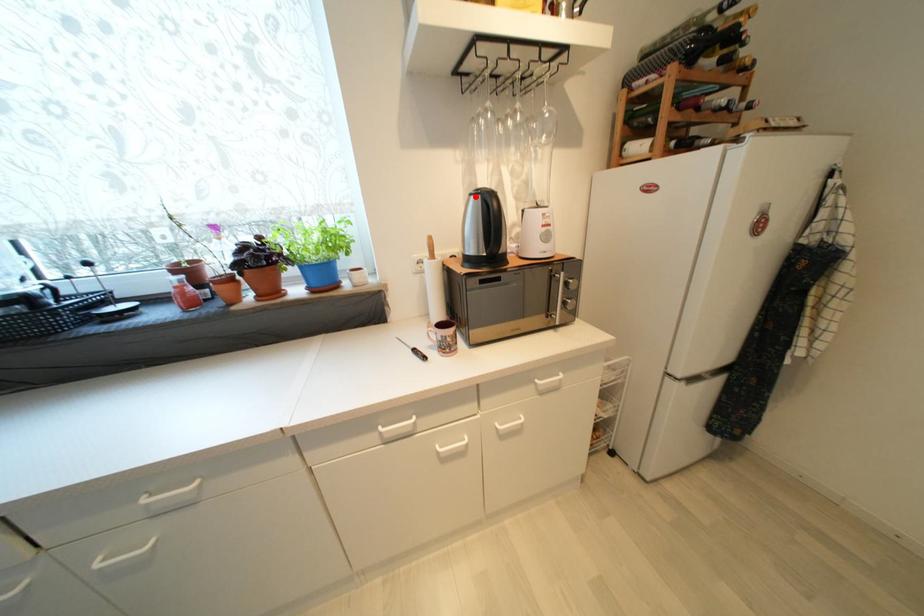
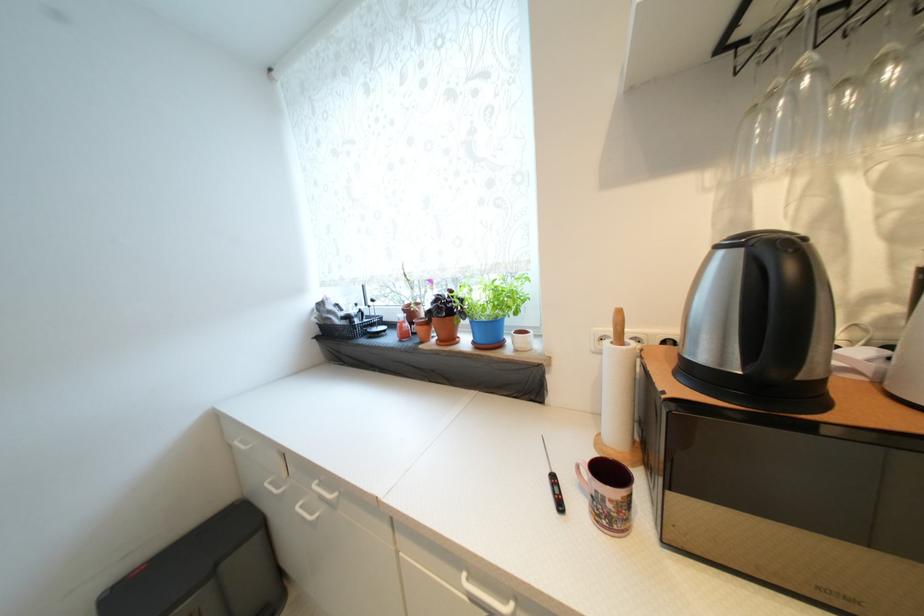
Find the pixel in the second image that matches the highlighted location in the first image.

(723, 249)